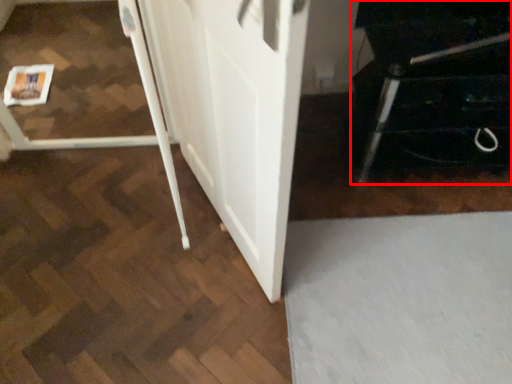
Question: From the image's perspective, where is furniture (annotated by the red box) located relative to barn door?

Choices:
 (A) below
 (B) above

Answer: (B)